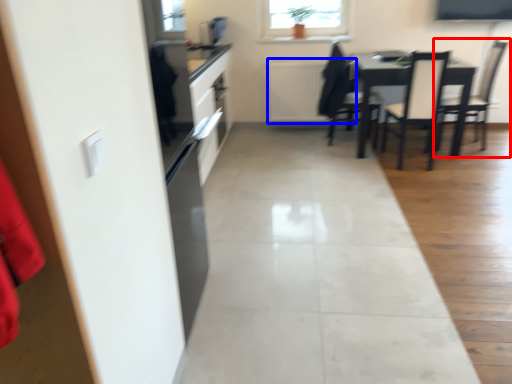
Question: Which point is closer to the camera, chair (highlighted by a red box) or radiator (highlighted by a blue box)?

Choices:
 (A) chair
 (B) radiator

Answer: (A)